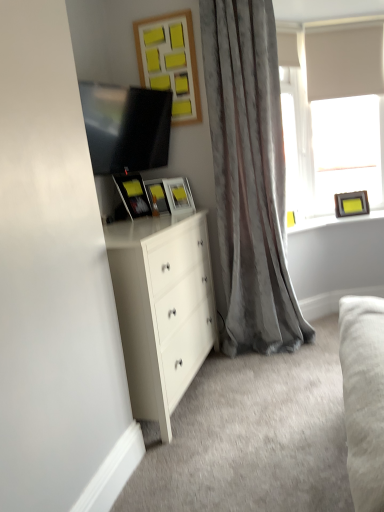
Locate an element on the screen. Image resolution: width=384 pixels, height=512 pixels. free space in front of matte yellow picture frame at upper center, which ranks as the second picture frame in right-to-left order is located at coordinates (176, 214).